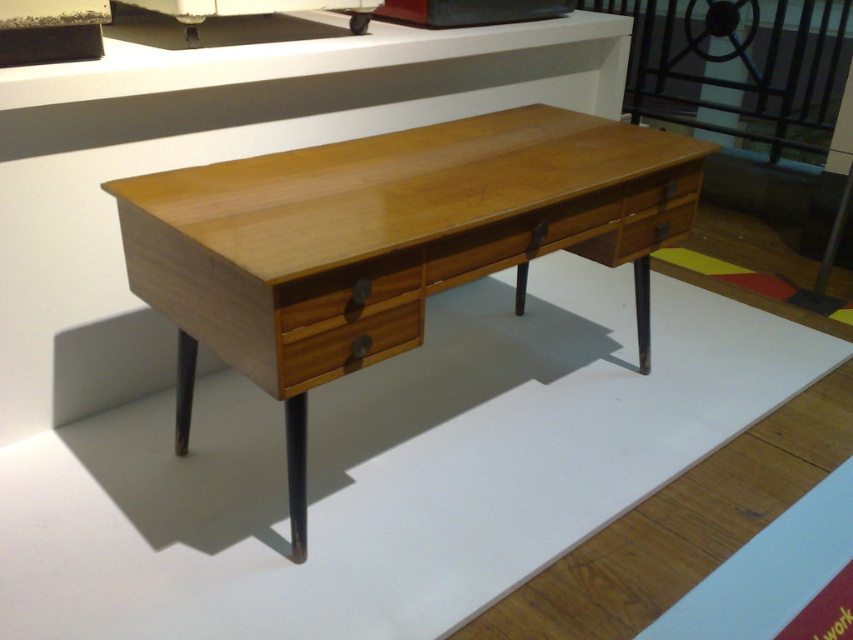
Question: Considering the relative positions of light wood desk at center and wooden drawer at center in the image provided, where is light wood desk at center located with respect to wooden drawer at center?

Choices:
 (A) right
 (B) left

Answer: (A)

Question: Does light wood desk at center have a greater width compared to wooden drawer at center?

Choices:
 (A) no
 (B) yes

Answer: (B)

Question: Is light wood desk at center further to camera compared to wooden drawer at center?

Choices:
 (A) no
 (B) yes

Answer: (A)